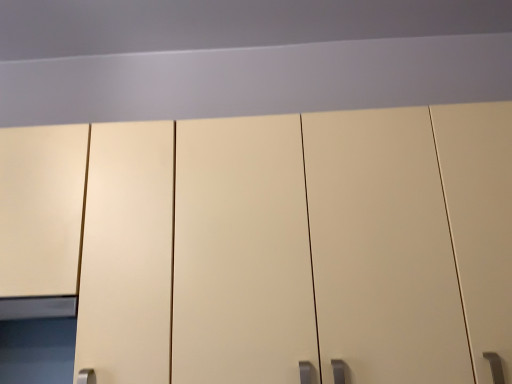
You are a GUI agent. You are given a task and a screenshot of the screen. Output one action in this format:
    pyautogui.click(x=<x>, y=<y>)
    Task: Click on the matte cream cupboard at center
    The width and height of the screenshot is (512, 384).
    Given the screenshot: What is the action you would take?
    (x=273, y=243)

This screenshot has width=512, height=384. What do you see at coordinates (273, 243) in the screenshot?
I see `matte cream cupboard at center` at bounding box center [273, 243].

The image size is (512, 384). What are the coordinates of `matte cream cupboard at center` in the screenshot? It's located at (273, 243).